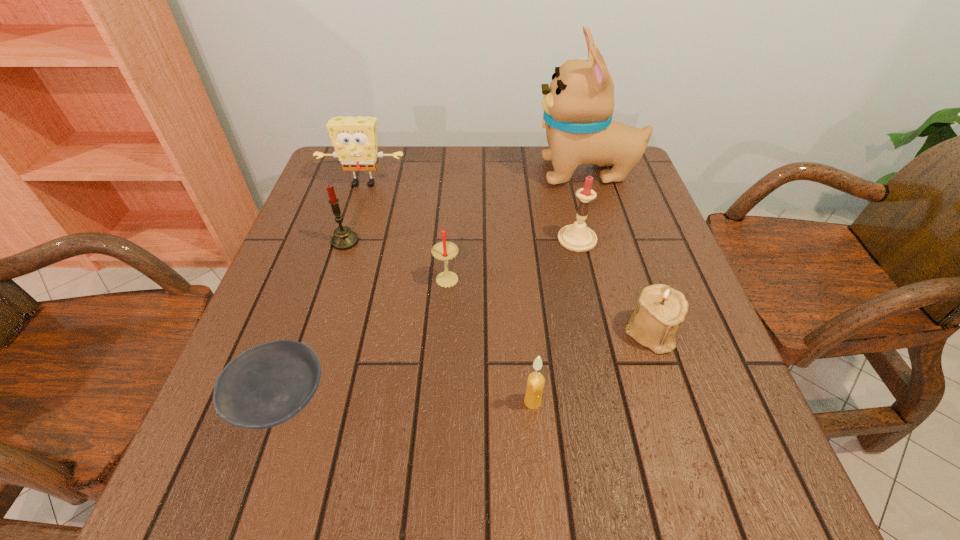
Locate an element on the screen. This screenshot has width=960, height=540. the tallest object is located at coordinates (578, 104).

The height and width of the screenshot is (540, 960). In order to click on sponge in this screenshot , I will do `click(354, 138)`.

Locate an element on the screen. the rightmost candle is located at coordinates (577, 237).

This screenshot has width=960, height=540. Identify the location of the leftmost candle. (343, 239).

Where is `the fourth object from right to left`? This screenshot has height=540, width=960. the fourth object from right to left is located at coordinates (536, 381).

The image size is (960, 540). I want to click on the second candle from right to left, so click(536, 381).

Find the location of `the fourth nearest object`. the fourth nearest object is located at coordinates (444, 251).

What are the coordinates of `the second nearest candle` in the screenshot? It's located at (444, 251).

I want to click on candle_holder, so click(x=661, y=308).

The height and width of the screenshot is (540, 960). I want to click on bowl, so click(x=265, y=386).